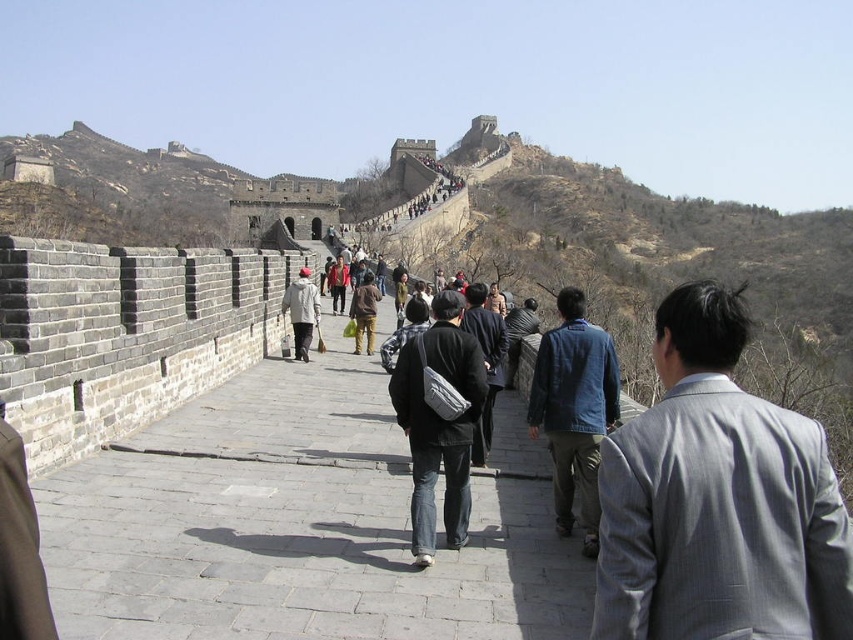
You are a photographer planning to take a group photo of the gray wool suit at center and the denim jacket at center. Which clothing item should you position closer to the camera to ensure both appear proportionally sized in the photo?

The denim jacket at center should be positioned closer to the camera because the gray wool suit at center is larger in size, balancing their apparent sizes in the photo.

You are standing on the Great Wall and see a person wearing a gray wool suit at center and another wearing a denim jacket at center. Which clothing item is positioned more to the right?

The gray wool suit at center is positioned to the right of the denim jacket at center, so the gray wool suit at center is more to the right.

You are a tour guide leading a group along the Great Wall. You notice the gray stone path at center and the gray wool suit at center. Which object is wider?

The gray stone path at center is wider than the gray wool suit at center.